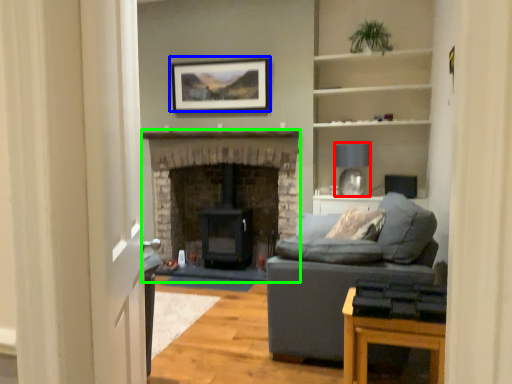
Question: Which is nearer to the lamp (highlighted by a red box)? picture frame (highlighted by a blue box) or fireplace (highlighted by a green box).

Choices:
 (A) picture frame
 (B) fireplace

Answer: (B)